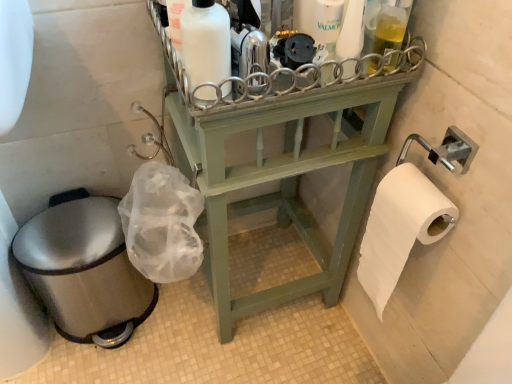
Question: Is light green wood shelf at center looking in the opposite direction of white plastic bottle at upper center?

Choices:
 (A) yes
 (B) no

Answer: (B)

Question: Would you say white plastic bottle at upper center is part of light green wood shelf at center's contents?

Choices:
 (A) no
 (B) yes

Answer: (A)

Question: Is light green wood shelf at center wider than white plastic bottle at upper center?

Choices:
 (A) no
 (B) yes

Answer: (B)

Question: Is there a large distance between light green wood shelf at center and white plastic bottle at upper center?

Choices:
 (A) yes
 (B) no

Answer: (B)

Question: Is light green wood shelf at center to the left of white plastic bottle at upper center from the viewer's perspective?

Choices:
 (A) no
 (B) yes

Answer: (B)

Question: From a real-world perspective, relative to light green wood shelf at center, is brushed metal toilet bowl at lower left vertically above or below?

Choices:
 (A) below
 (B) above

Answer: (A)

Question: Considering the positions of brushed metal toilet bowl at lower left and light green wood shelf at center in the image, is brushed metal toilet bowl at lower left wider or thinner than light green wood shelf at center?

Choices:
 (A) wide
 (B) thin

Answer: (B)

Question: Do you think brushed metal toilet bowl at lower left is within light green wood shelf at center, or outside of it?

Choices:
 (A) outside
 (B) inside

Answer: (A)

Question: In terms of height, does brushed metal toilet bowl at lower left look taller or shorter compared to light green wood shelf at center?

Choices:
 (A) short
 (B) tall

Answer: (A)

Question: Is light green wood shelf at center inside or outside of white matte bottle at upper center?

Choices:
 (A) outside
 (B) inside

Answer: (A)

Question: In terms of height, does light green wood shelf at center look taller or shorter compared to white matte bottle at upper center?

Choices:
 (A) tall
 (B) short

Answer: (A)

Question: Relative to white matte bottle at upper center, is light green wood shelf at center in front or behind?

Choices:
 (A) front
 (B) behind

Answer: (B)

Question: In the image, is light green wood shelf at center on the left side or the right side of white matte bottle at upper center?

Choices:
 (A) right
 (B) left

Answer: (A)

Question: Considering the positions of point (192, 36) and point (311, 157), is point (192, 36) closer or farther from the camera than point (311, 157)?

Choices:
 (A) farther
 (B) closer

Answer: (B)

Question: From the image's perspective, is white matte bottle at upper center above or below light green wood shelf at center?

Choices:
 (A) above
 (B) below

Answer: (A)